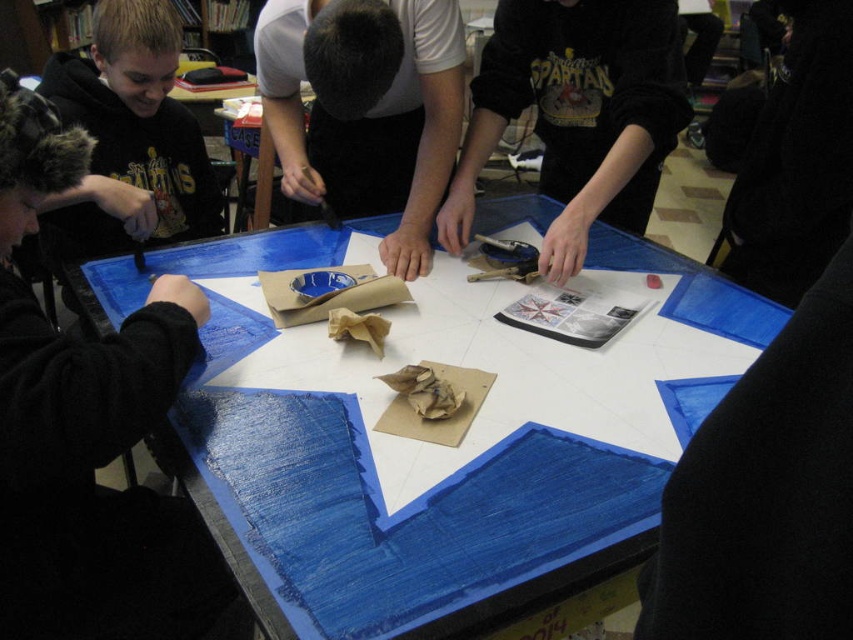
Between blue painted wood table at center and matte black hoodie at left, which one has more height?

blue painted wood table at center is taller.

Measure the distance between blue painted wood table at center and camera.

29.09 inches

The image size is (853, 640). I want to click on blue painted wood table at center, so click(x=401, y=522).

Can you confirm if black cotton sweatshirt at upper center is positioned below white matte paper at center?

Correct, black cotton sweatshirt at upper center is located below white matte paper at center.

Describe the element at coordinates (577, 115) in the screenshot. I see `black cotton sweatshirt at upper center` at that location.

Locate an element on the screen. This screenshot has width=853, height=640. black cotton sweatshirt at upper center is located at coordinates 577,115.

The height and width of the screenshot is (640, 853). What do you see at coordinates (577, 115) in the screenshot?
I see `black cotton sweatshirt at upper center` at bounding box center [577, 115].

Identify the location of black cotton sweatshirt at upper center. (577, 115).